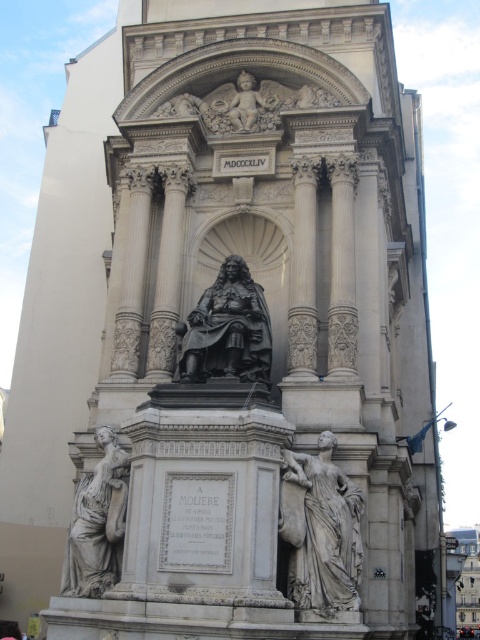
Is point (225, 340) positioned in front of point (87, 554)?

No, it is behind (87, 554).

Can you confirm if black polished stone statue at center is taller than white marble statue at lower left?

Incorrect, black polished stone statue at center's height is not larger of white marble statue at lower left's.

The image size is (480, 640). What do you see at coordinates (228, 330) in the screenshot?
I see `black polished stone statue at center` at bounding box center [228, 330].

Where is `black polished stone statue at center`? This screenshot has height=640, width=480. black polished stone statue at center is located at coordinates (228, 330).

Between white marble statue at center and white marble statue at lower left, which one appears on the right side from the viewer's perspective?

Positioned to the right is white marble statue at center.

Is white marble statue at center to the left of white marble statue at lower left from the viewer's perspective?

No, white marble statue at center is not to the left of white marble statue at lower left.

Who is more distant from viewer, (313,572) or (83,512)?

Point (83,512)

The width and height of the screenshot is (480, 640). I want to click on white marble statue at center, so pyautogui.click(x=321, y=529).

Is white marble statue at center taller than matte stone cherub at upper center?

Indeed, white marble statue at center has a greater height compared to matte stone cherub at upper center.

Identify the location of white marble statue at center. The image size is (480, 640). (321, 529).